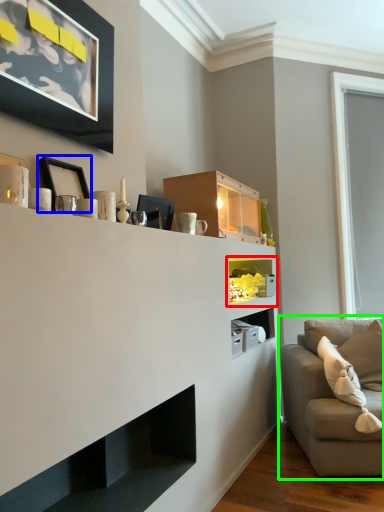
Question: Estimate the real-world distances between objects in this image. Which object is closer to shelf (highlighted by a red box), picture frame (highlighted by a blue box) or studio couch (highlighted by a green box)?

Choices:
 (A) picture frame
 (B) studio couch

Answer: (B)